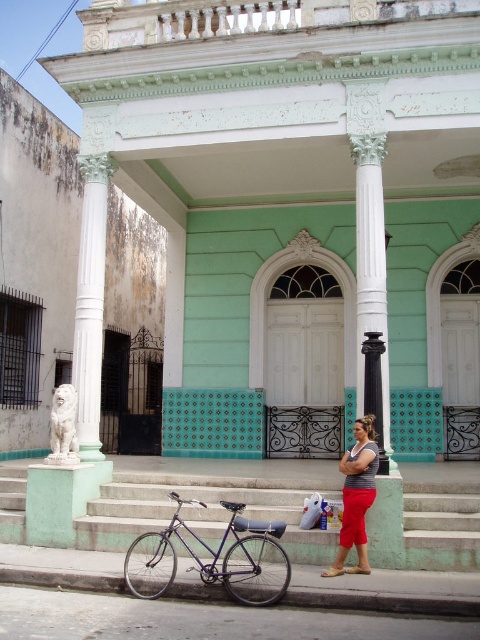
Between shiny blue bicycle at lower left and gray striped tank top at center, which one appears on the right side from the viewer's perspective?

From the viewer's perspective, gray striped tank top at center appears more on the right side.

Based on the photo, measure the distance between shiny blue bicycle at lower left and camera.

The distance of shiny blue bicycle at lower left from camera is 8.29 meters.

Locate an element on the screen. This screenshot has height=640, width=480. shiny blue bicycle at lower left is located at coordinates (214, 557).

Is smooth concrete stairs at center taller than gray striped tank top at center?

No.

Is point (143, 474) behind point (360, 500)?

That is True.

Is point (202, 467) more distant than point (359, 435)?

Yes, it is.

Identify the location of smooth concrete stairs at center. The height and width of the screenshot is (640, 480). (210, 500).

Can you confirm if shiny blue bicycle at lower left is bigger than white marble column at center?

Correct, shiny blue bicycle at lower left is larger in size than white marble column at center.

What do you see at coordinates (214, 557) in the screenshot? I see `shiny blue bicycle at lower left` at bounding box center [214, 557].

I want to click on shiny blue bicycle at lower left, so click(x=214, y=557).